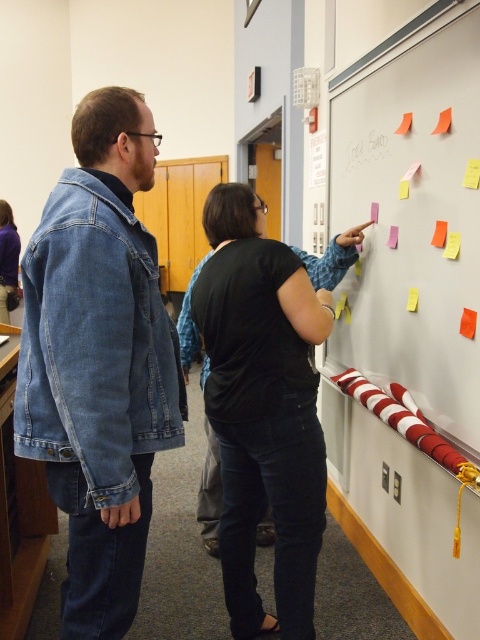
Consider the image. Is denim jacket at left wider than multicolored sticky notes at upper right?

Yes, denim jacket at left is wider than multicolored sticky notes at upper right.

Which of these two, denim jacket at left or multicolored sticky notes at upper right, stands shorter?

Standing shorter between the two is denim jacket at left.

Image resolution: width=480 pixels, height=640 pixels. What do you see at coordinates (98, 360) in the screenshot? I see `denim jacket at left` at bounding box center [98, 360].

Locate an element on the screen. The width and height of the screenshot is (480, 640). denim jacket at left is located at coordinates (98, 360).

Is the position of denim jacket at left less distant than that of black matte shirt at upper center?

That is True.

Identify the location of denim jacket at left. (98, 360).

Does denim jacket at left have a larger size compared to white paper at upper center?

Correct, denim jacket at left is larger in size than white paper at upper center.

Looking at this image, is denim jacket at left taller than white paper at upper center?

Indeed, denim jacket at left has a greater height compared to white paper at upper center.

This screenshot has height=640, width=480. What do you see at coordinates (98, 360) in the screenshot?
I see `denim jacket at left` at bounding box center [98, 360].

Identify the location of denim jacket at left. (98, 360).